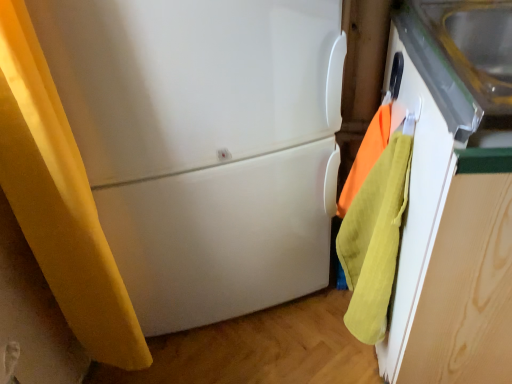
Question: Considering the relative sizes of white matte refrigerator at center and orange cotton towel at right in the image provided, is white matte refrigerator at center bigger than orange cotton towel at right?

Choices:
 (A) yes
 (B) no

Answer: (A)

Question: Is the position of white matte refrigerator at center less distant than that of orange cotton towel at right?

Choices:
 (A) no
 (B) yes

Answer: (B)

Question: Is white matte refrigerator at center not inside orange cotton towel at right?

Choices:
 (A) yes
 (B) no

Answer: (A)

Question: Does white matte refrigerator at center touch orange cotton towel at right?

Choices:
 (A) yes
 (B) no

Answer: (B)

Question: Considering the relative sizes of white matte refrigerator at center and orange cotton towel at right in the image provided, is white matte refrigerator at center taller than orange cotton towel at right?

Choices:
 (A) yes
 (B) no

Answer: (A)

Question: Considering the relative sizes of white matte refrigerator at center and orange cotton towel at right in the image provided, is white matte refrigerator at center smaller than orange cotton towel at right?

Choices:
 (A) yes
 (B) no

Answer: (B)

Question: Is orange cotton towel at right oriented away from white matte refrigerator at center?

Choices:
 (A) no
 (B) yes

Answer: (A)

Question: Does orange cotton towel at right come in front of white matte refrigerator at center?

Choices:
 (A) yes
 (B) no

Answer: (B)

Question: Would you say orange cotton towel at right is outside white matte refrigerator at center?

Choices:
 (A) no
 (B) yes

Answer: (B)

Question: Considering the relative sizes of orange cotton towel at right and white matte refrigerator at center in the image provided, is orange cotton towel at right taller than white matte refrigerator at center?

Choices:
 (A) yes
 (B) no

Answer: (B)

Question: Is orange cotton towel at right smaller than white matte refrigerator at center?

Choices:
 (A) no
 (B) yes

Answer: (B)

Question: Is white matte refrigerator at center a part of orange cotton towel at right?

Choices:
 (A) yes
 (B) no

Answer: (B)

Question: Looking at the image, does orange cotton towel at right seem bigger or smaller compared to white matte refrigerator at center?

Choices:
 (A) small
 (B) big

Answer: (A)